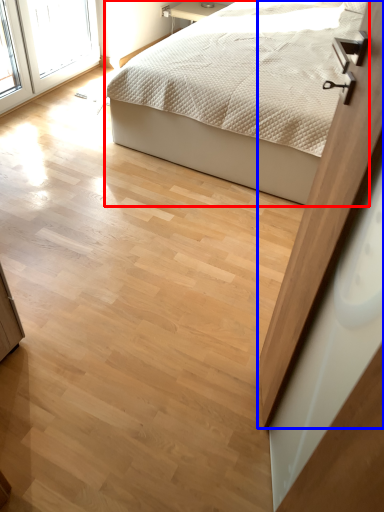
Question: Among these objects, which one is nearest to the camera, bed (highlighted by a red box) or screen door (highlighted by a blue box)?

Choices:
 (A) bed
 (B) screen door

Answer: (B)